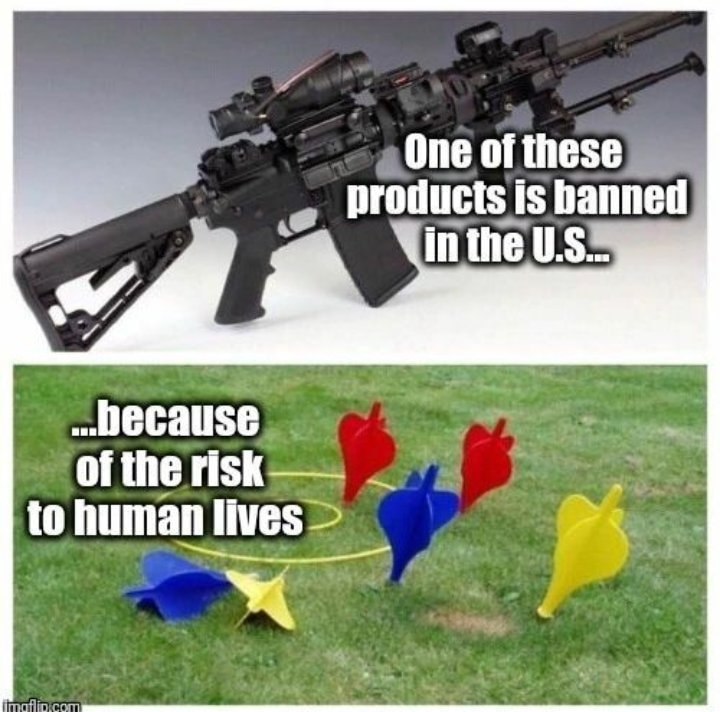
The height and width of the screenshot is (712, 720). What are the coordinates of `stand` in the screenshot? It's located at (114, 246).